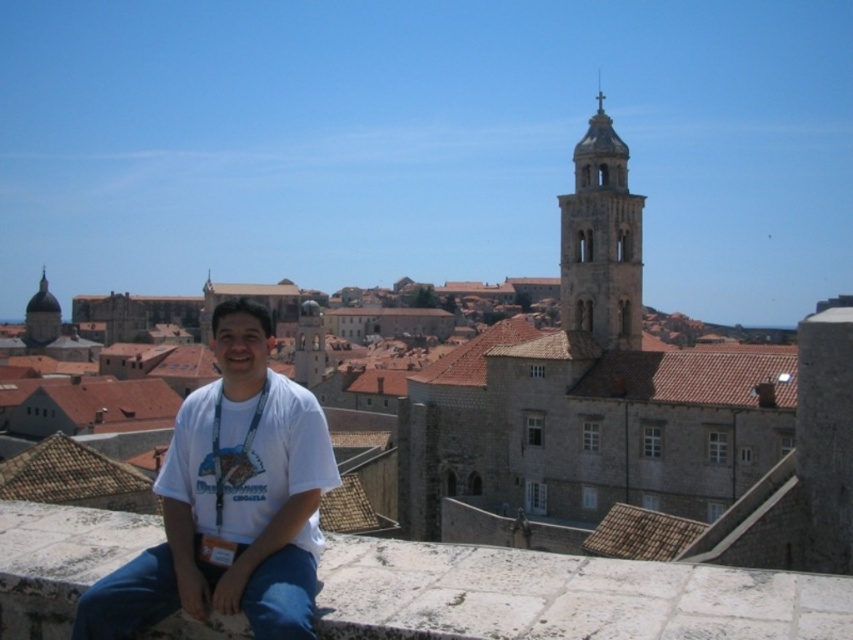
You are standing in the historic town scene and want to determine the relative positions of two points marked in the image. Specifically, you need to know which point is nearer to you. The points are labeled as point (612, 243) and point (36, 342). Can you identify which one is closer?

Point (612, 243) is closer to the viewer than point (36, 342).

You are standing in the historic town and want to take a photo of both the person sitting on the stone wall and the bell tower. The person is at point (274, 624) and the bell tower is at point (577, 243). Since you can only focus on one point at a time, which point should you focus on to ensure the person is in focus while the bell tower is still somewhat visible?

You should focus on point (274, 624) because it is closer to the viewer than point (577, 243). This will keep the person in focus while the bell tower, being farther away, will still be somewhat visible but slightly less sharp.

You are a photographer planning to capture the historic town scene. You notice the white cotton shirt at center and the matte brown dome at upper left in your viewfinder. Which object is located to the right of the other?

The white cotton shirt at center is positioned on the right side of matte brown dome at upper left.